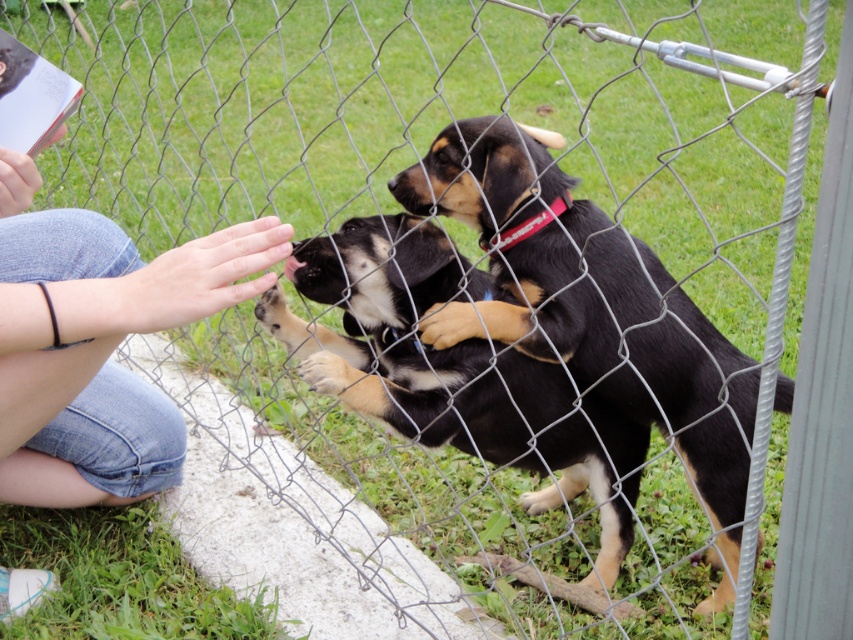
Question: Estimate the real-world distances between objects in this image. Which object is closer to the black fur dog at center?

Choices:
 (A) black fur puppy at center
 (B) jeans at left

Answer: (A)

Question: Does jeans at left appear over black smooth nose at center?

Choices:
 (A) yes
 (B) no

Answer: (B)

Question: Which object is the farthest from the black fur dog at center?

Choices:
 (A) jeans at left
 (B) black fur puppy at center

Answer: (A)

Question: Is jeans at left further to camera compared to black smooth nose at center?

Choices:
 (A) yes
 (B) no

Answer: (B)

Question: Is jeans at left to the right of black smooth nose at center from the viewer's perspective?

Choices:
 (A) no
 (B) yes

Answer: (A)

Question: Which point is farther to the camera?

Choices:
 (A) (350, 289)
 (B) (393, 177)

Answer: (A)